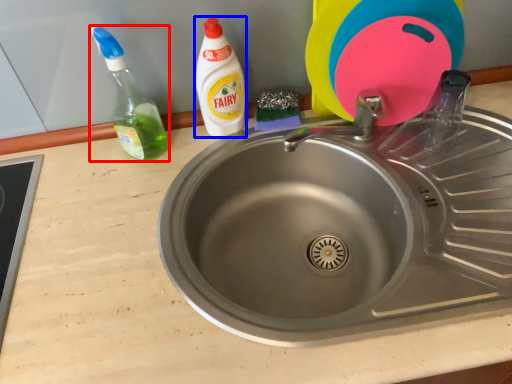
Question: Which object appears closest to the camera in this image, bottle (highlighted by a red box) or cleaning product (highlighted by a blue box)?

Choices:
 (A) bottle
 (B) cleaning product

Answer: (A)